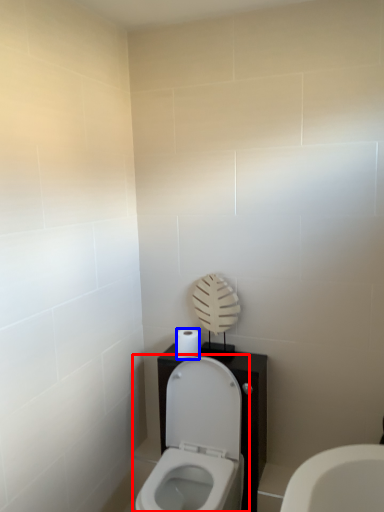
Question: Which object appears closest to the camera in this image, toilet (highlighted by a red box) or toilet paper (highlighted by a blue box)?

Choices:
 (A) toilet
 (B) toilet paper

Answer: (A)